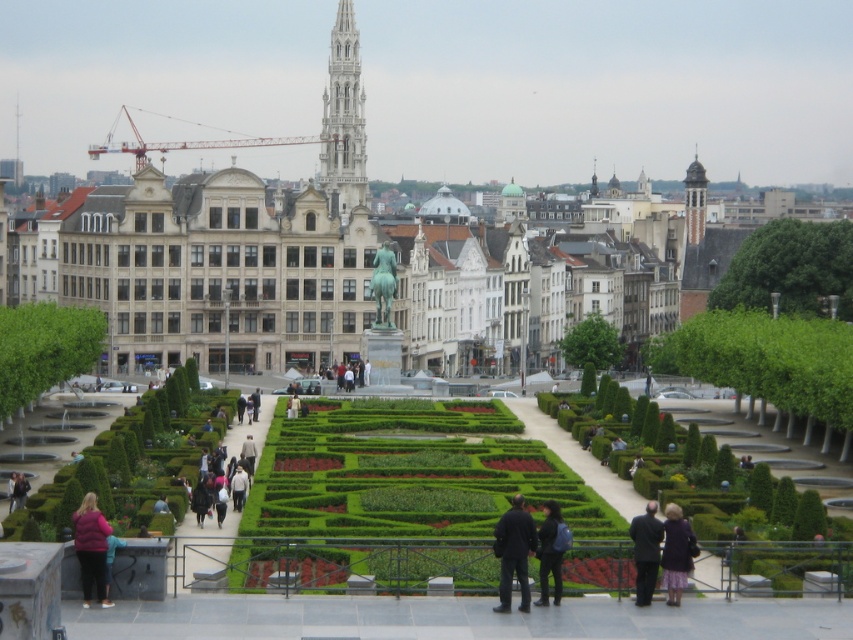
Question: Which object is the farthest from the green leafy hedge at center-right?

Choices:
 (A) white fabric jacket at center
 (B) dark gray jacket at center
 (C) white stone tower at upper center
 (D) dark blue fabric coat at lower center

Answer: (C)

Question: Can you confirm if dark blue fabric jacket at center is positioned to the left of bronze statue at center?

Choices:
 (A) yes
 (B) no

Answer: (B)

Question: Where is green leafy hedge at center located in relation to bronze statue at center in the image?

Choices:
 (A) below
 (B) above

Answer: (A)

Question: Among these points, which one is nearest to the camera?

Choices:
 (A) (509, 545)
 (B) (103, 566)

Answer: (B)

Question: Which object appears farthest from the camera in this image?

Choices:
 (A) bronze statue at center
 (B) green hedge at center

Answer: (A)

Question: Does green leafy hedge at center-right appear under light beige jacket at center?

Choices:
 (A) no
 (B) yes

Answer: (A)